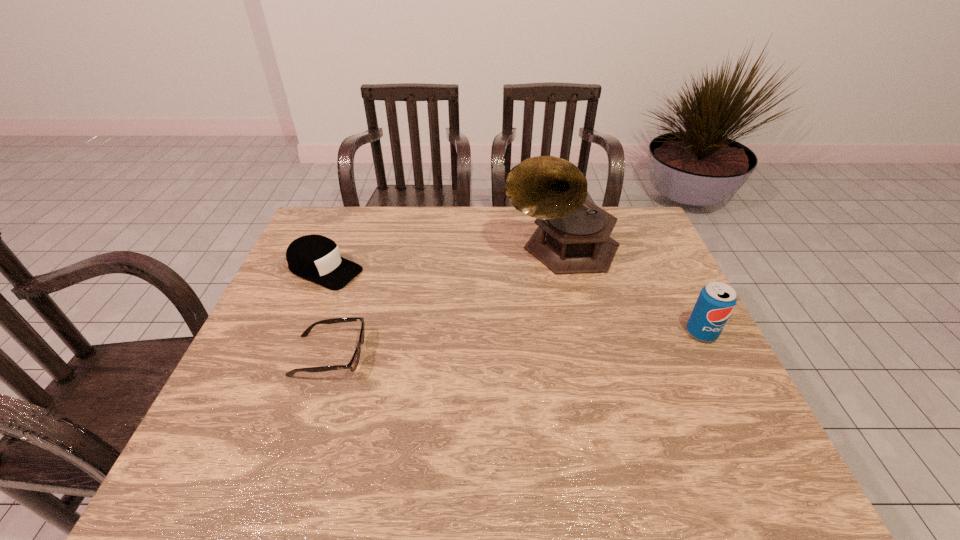
Find the location of a particular element. vacant position at the far edge of the desktop is located at coordinates (459, 207).

This screenshot has width=960, height=540. Find the location of `free space at the near edge of the desktop`. free space at the near edge of the desktop is located at coordinates (593, 419).

This screenshot has width=960, height=540. Identify the location of free space at the left edge. (268, 339).

Where is `free location at the far right corner`? The width and height of the screenshot is (960, 540). free location at the far right corner is located at coordinates (627, 232).

The image size is (960, 540). Identify the location of vacant point at the near right corner. (742, 415).

Where is `vacant region between the cap and the tallest object`? vacant region between the cap and the tallest object is located at coordinates (443, 259).

The height and width of the screenshot is (540, 960). I want to click on empty space that is in between the cap and the phonograph record, so click(443, 259).

The image size is (960, 540). I want to click on empty space that is in between the shortest object and the third tallest object, so click(327, 313).

Find the location of a particular element. The width and height of the screenshot is (960, 540). vacant space in between the rightmost object and the cap is located at coordinates (513, 301).

Where is `free spot between the phonograph record and the soda can`? The width and height of the screenshot is (960, 540). free spot between the phonograph record and the soda can is located at coordinates (632, 290).